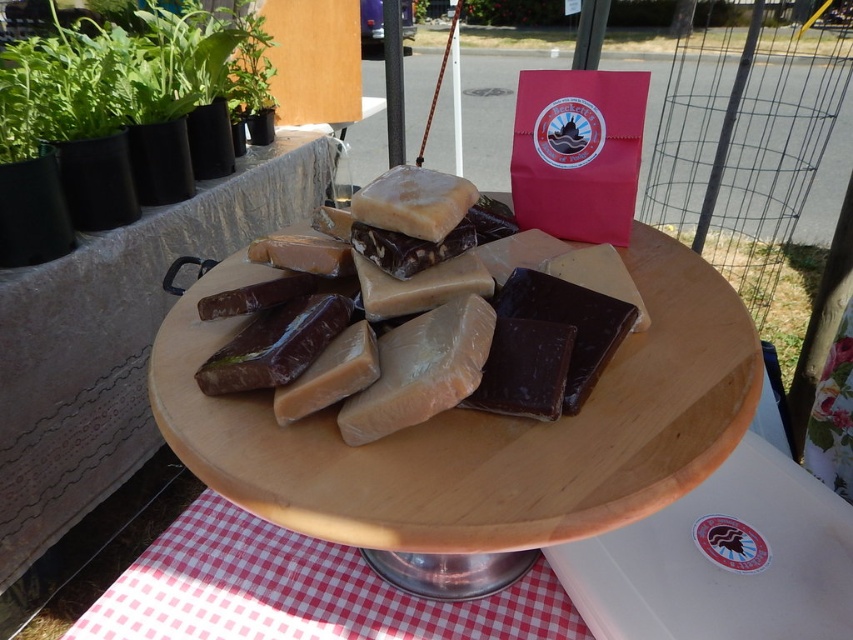
You are holding a camera and want to take a photo of the point at coordinates (633, 324) on the display. The camera has a minimum focus distance of 20 inches. Will the point be in focus?

The point at coordinates (633, 324) is 20.69 inches away from the camera, which is beyond the minimum focus distance of 20 inches. Therefore, the point will be in focus.

You are a customer at a cheese shop and want to find the dark brown hard cheese at center. Based on the coordinates provided, can you determine its exact position on the wooden stand?

The dark brown hard cheese at center is located at the 2D coordinates point (598, 275) on the wooden stand.

You are a customer at a cheese shop looking at the display. You want to reach the translucent brown cheese at center to smell it. Can you easily access it without moving the dark brown hard cheese at center?

The translucent brown cheese at center is below the dark brown hard cheese at center, so you cannot easily access it without moving the dark brown hard cheese at center.